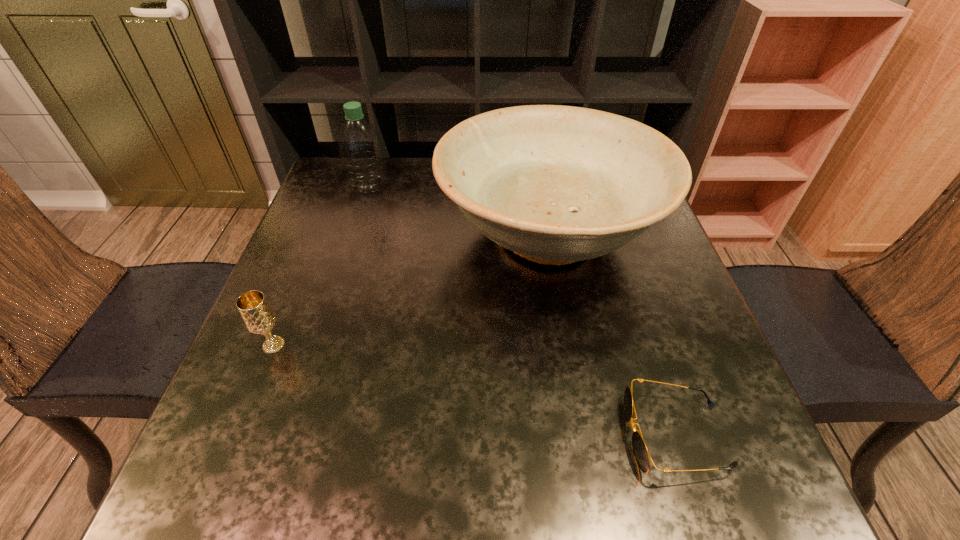
Identify the location of water bottle. (359, 144).

Where is `dish`? dish is located at coordinates (555, 184).

Identify the location of chalice. (259, 318).

This screenshot has width=960, height=540. What are the coordinates of `the leftmost object` in the screenshot? It's located at (259, 318).

This screenshot has height=540, width=960. I want to click on the shortest object, so click(x=642, y=456).

Where is `the nearest object`? The width and height of the screenshot is (960, 540). the nearest object is located at coordinates (642, 456).

Find the location of a particular element. This screenshot has height=540, width=960. free space located 0.230m on the front of the second object from left to right is located at coordinates (347, 255).

What are the coordinates of `vacant space located on the left of the dish` in the screenshot? It's located at (381, 234).

Locate an element on the screen. Image resolution: width=960 pixels, height=540 pixels. free space located 0.200m on the back of the third farthest object is located at coordinates (306, 265).

The width and height of the screenshot is (960, 540). What are the coordinates of `free point located 0.230m on the front-facing side of the sunglasses` in the screenshot? It's located at (485, 435).